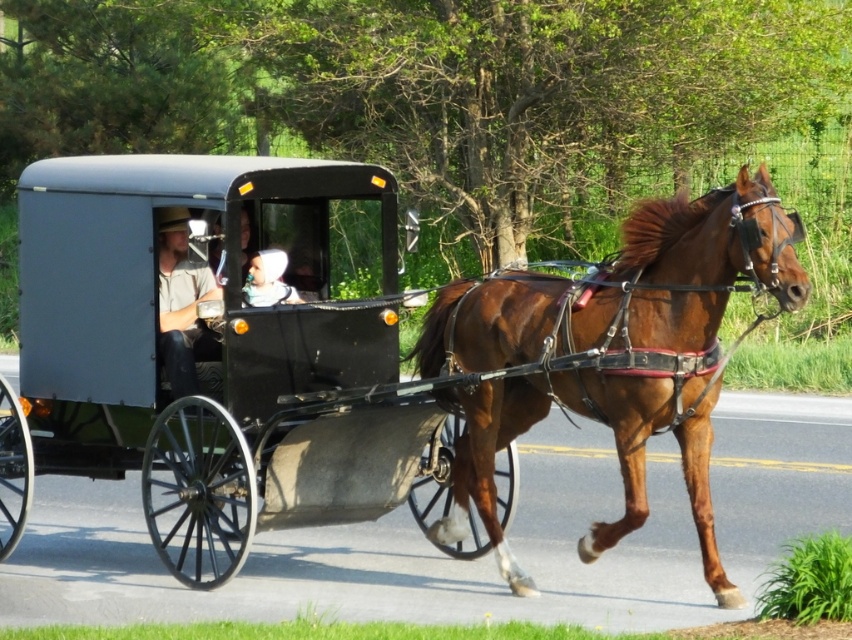
Question: Considering the relative positions of matte black horse cart at center and white fabric headscarf at center in the image provided, where is matte black horse cart at center located with respect to white fabric headscarf at center?

Choices:
 (A) above
 (B) below

Answer: (B)

Question: Which is farther from the white fabric headscarf at center?

Choices:
 (A) matte black horse cart at center
 (B) matte gray hat at center

Answer: (A)

Question: Which object appears closest to the camera in this image?

Choices:
 (A) white fabric headscarf at center
 (B) brown glossy horse at center

Answer: (B)

Question: Which object is farther from the camera taking this photo?

Choices:
 (A) matte black horse cart at center
 (B) white fabric headscarf at center
 (C) matte gray hat at center

Answer: (B)

Question: Is matte gray hat at center to the right of white fabric headscarf at center from the viewer's perspective?

Choices:
 (A) yes
 (B) no

Answer: (B)

Question: Observing the image, what is the correct spatial positioning of matte black horse cart at center in reference to matte gray hat at center?

Choices:
 (A) below
 (B) above

Answer: (A)